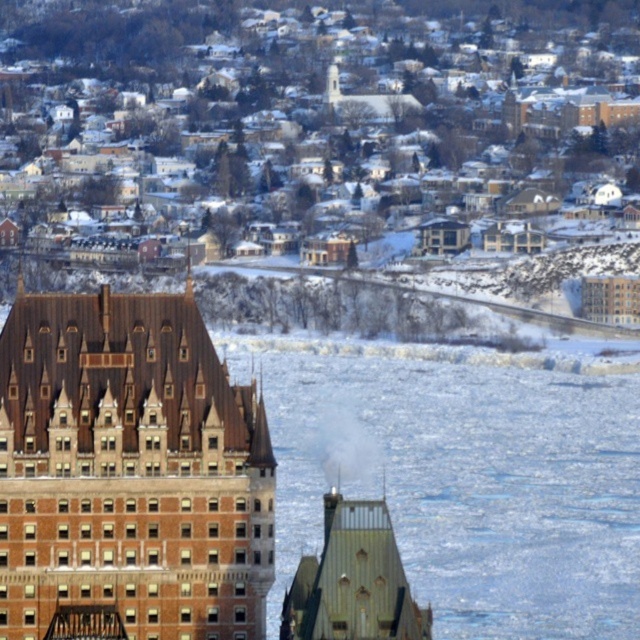
Question: Among these objects, which one is farthest from the camera?

Choices:
 (A) green metallic tower at center
 (B) brown brick building at left

Answer: (B)

Question: Is brown brick building at left below green metallic tower at center?

Choices:
 (A) yes
 (B) no

Answer: (B)

Question: Among these points, which one is nearest to the camera?

Choices:
 (A) (396, 625)
 (B) (128, 451)

Answer: (A)

Question: Is brown brick building at left positioned before green metallic tower at center?

Choices:
 (A) yes
 (B) no

Answer: (B)

Question: Is brown brick building at left to the left of green metallic tower at center from the viewer's perspective?

Choices:
 (A) no
 (B) yes

Answer: (B)